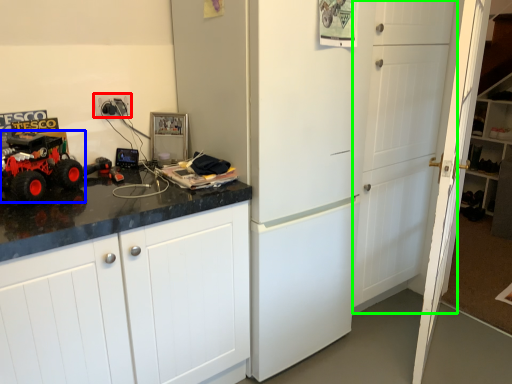
Question: Which object is positioned closest to electric outlet (highlighted by a red box)? Select from land vehicle (highlighted by a blue box) and door (highlighted by a green box).

Choices:
 (A) land vehicle
 (B) door

Answer: (A)